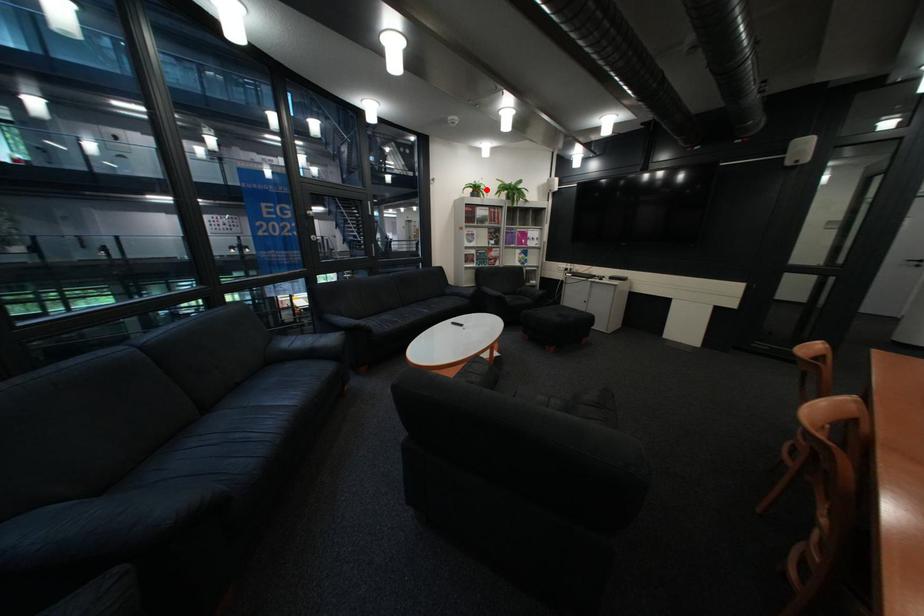
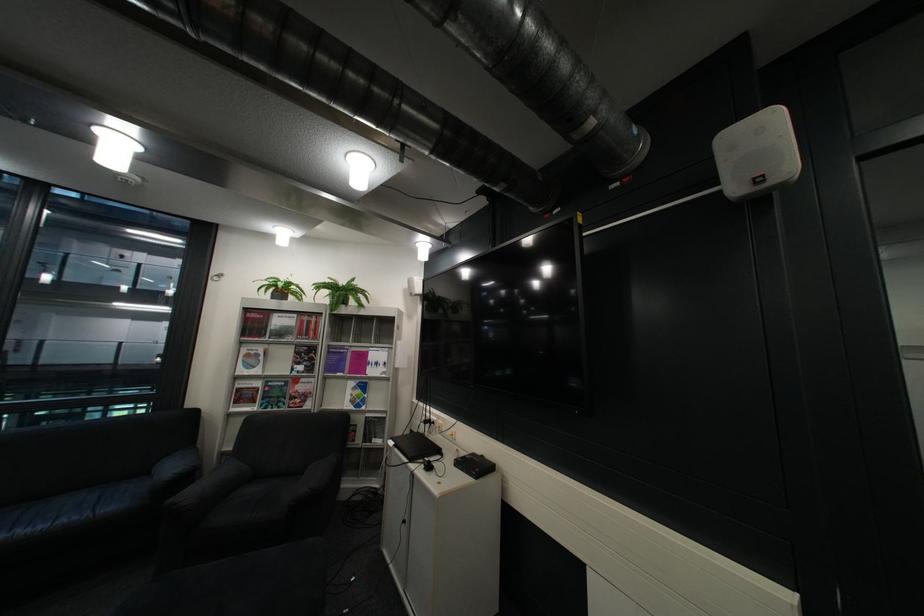
In the second image, find the point that corresponds to the highlighted location in the first image.

(287, 290)